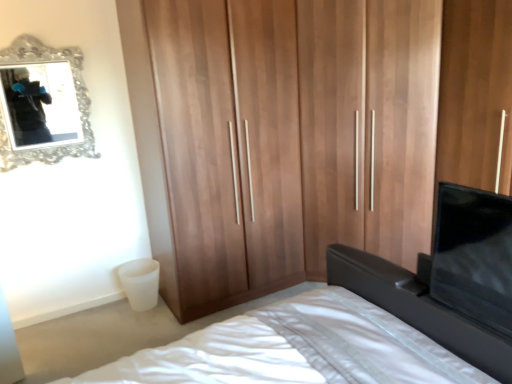
Question: In terms of height, does wooden wardrobe at center look taller or shorter compared to matte black vanity at lower right?

Choices:
 (A) tall
 (B) short

Answer: (A)

Question: Is point (169, 67) positioned closer to the camera than point (355, 288)?

Choices:
 (A) farther
 (B) closer

Answer: (A)

Question: Which of these objects is positioned farthest from the white fabric bed at center?

Choices:
 (A) matte black vanity at lower right
 (B) wooden wardrobe at center

Answer: (B)

Question: Estimate the real-world distances between objects in this image. Which object is closer to the wooden wardrobe at center?

Choices:
 (A) white fabric bed at center
 (B) matte black vanity at lower right

Answer: (A)